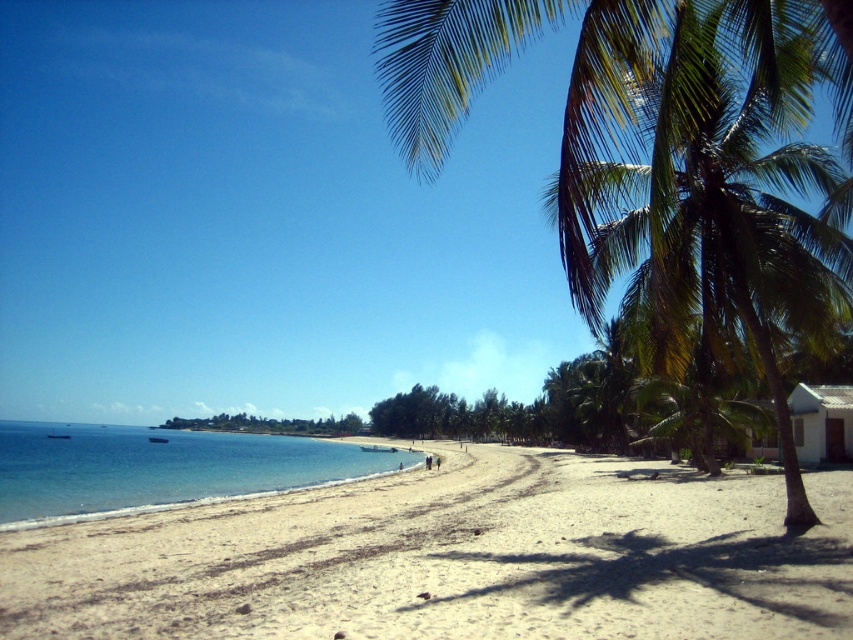
Question: Does clear blue water at lower left have a smaller size compared to white matte hut at lower right?

Choices:
 (A) no
 (B) yes

Answer: (A)

Question: Is green leafy palm tree at right further to camera compared to clear blue water at lower left?

Choices:
 (A) yes
 (B) no

Answer: (B)

Question: Which of the following is the farthest from the observer?

Choices:
 (A) (184, 486)
 (B) (670, 49)

Answer: (A)

Question: Estimate the real-world distances between objects in this image. Which object is farther from the white matte hut at lower right?

Choices:
 (A) green leafy palm tree at right
 (B) clear blue water at lower left
 (C) white sandy beach at lower left

Answer: (B)

Question: Among these objects, which one is nearest to the camera?

Choices:
 (A) clear blue water at lower left
 (B) green leafy palm tree at right
 (C) white sandy beach at lower left

Answer: (B)

Question: Can you confirm if white sandy beach at lower left is thinner than white matte hut at lower right?

Choices:
 (A) yes
 (B) no

Answer: (B)